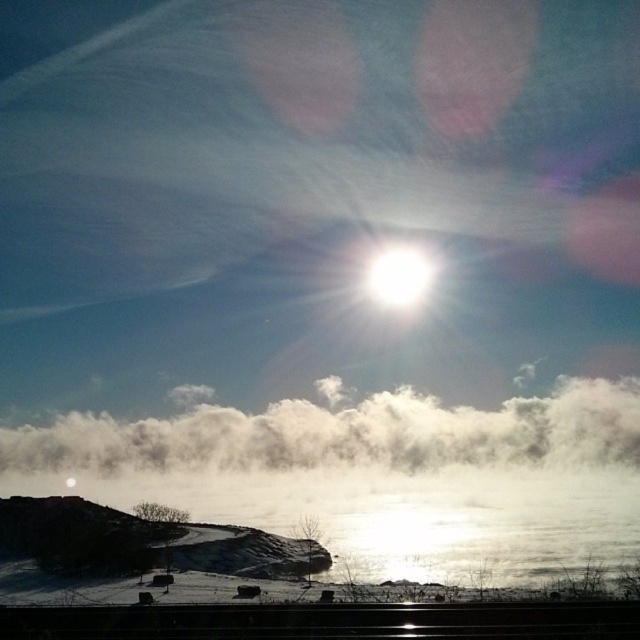
Who is positioned more to the left, white fluffy cloud at center or white glossy sun at upper center?

Positioned to the left is white fluffy cloud at center.

Does white fluffy cloud at center appear under white glossy sun at upper center?

Yes, white fluffy cloud at center is below white glossy sun at upper center.

Is point (577, 436) closer to camera compared to point (426, 262)?

That is True.

Identify the location of white fluffy cloud at center. The height and width of the screenshot is (640, 640). (342, 435).